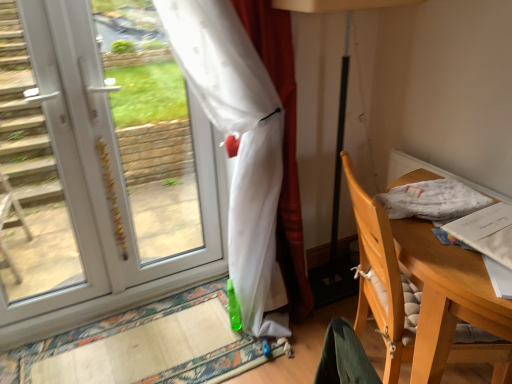
Question: Is wooden chair at right not within white fabric at right?

Choices:
 (A) yes
 (B) no

Answer: (A)

Question: Is wooden chair at right taller than white fabric at right?

Choices:
 (A) no
 (B) yes

Answer: (B)

Question: From a real-world perspective, is wooden chair at right on white fabric at right?

Choices:
 (A) no
 (B) yes

Answer: (A)

Question: From the image's perspective, is wooden chair at right located above white fabric at right?

Choices:
 (A) no
 (B) yes

Answer: (A)

Question: Is wooden chair at right next to white fabric at right and touching it?

Choices:
 (A) no
 (B) yes

Answer: (A)

Question: Is wooden chair at right looking in the opposite direction of white fabric at right?

Choices:
 (A) no
 (B) yes

Answer: (A)

Question: Considering the relative sizes of white plastic door at left and wooden chair at right in the image provided, is white plastic door at left taller than wooden chair at right?

Choices:
 (A) no
 (B) yes

Answer: (B)

Question: Does white plastic door at left come behind wooden chair at right?

Choices:
 (A) no
 (B) yes

Answer: (B)

Question: From a real-world perspective, is white plastic door at left located beneath wooden chair at right?

Choices:
 (A) yes
 (B) no

Answer: (B)

Question: Is white plastic door at left facing away from wooden chair at right?

Choices:
 (A) no
 (B) yes

Answer: (A)

Question: Does white plastic door at left have a lesser width compared to wooden chair at right?

Choices:
 (A) no
 (B) yes

Answer: (B)

Question: Considering the relative sizes of white plastic door at left and wooden chair at right in the image provided, is white plastic door at left smaller than wooden chair at right?

Choices:
 (A) yes
 (B) no

Answer: (A)

Question: Is white plastic door at left to the left of translucent white curtain at left from the viewer's perspective?

Choices:
 (A) yes
 (B) no

Answer: (A)